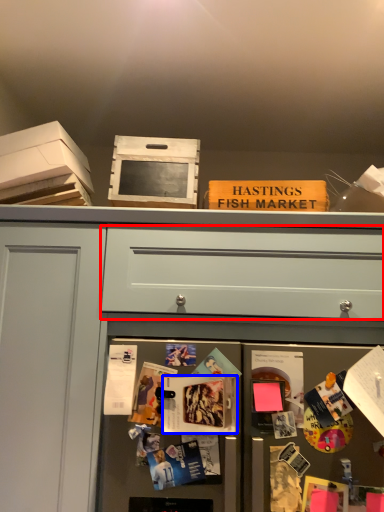
Question: Among these objects, which one is nearest to the camera, drawer (highlighted by a red box) or magazine (highlighted by a blue box)?

Choices:
 (A) drawer
 (B) magazine

Answer: (B)